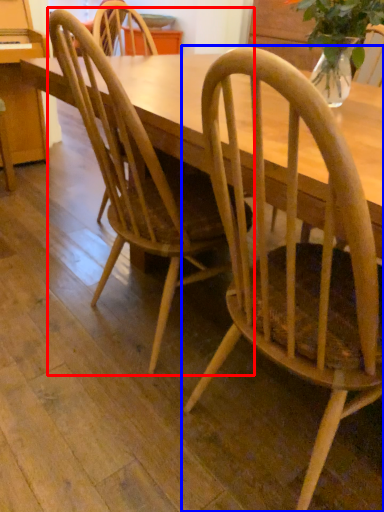
Question: Which object is closer to the camera taking this photo, chair (highlighted by a red box) or chair (highlighted by a blue box)?

Choices:
 (A) chair
 (B) chair

Answer: (B)